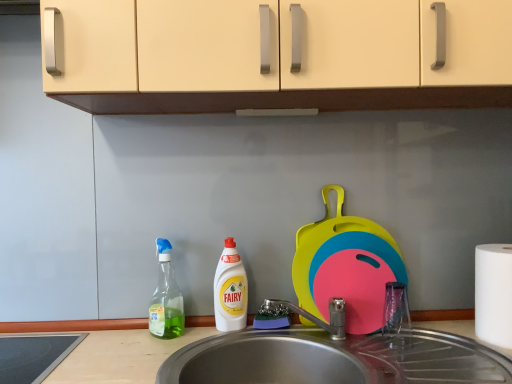
Question: Should I look upward or downward to see transparent plastic spray bottle at left?

Choices:
 (A) down
 (B) up

Answer: (A)

Question: Can you confirm if white plastic bottle at center is bigger than white matte paper towel at right?

Choices:
 (A) yes
 (B) no

Answer: (B)

Question: Can you confirm if white plastic bottle at center is positioned to the left of white matte paper towel at right?

Choices:
 (A) yes
 (B) no

Answer: (A)

Question: Can you confirm if white plastic bottle at center is positioned to the right of white matte paper towel at right?

Choices:
 (A) yes
 (B) no

Answer: (B)

Question: Is white plastic bottle at center further to camera compared to white matte paper towel at right?

Choices:
 (A) no
 (B) yes

Answer: (B)

Question: Is white plastic bottle at center touching white matte paper towel at right?

Choices:
 (A) yes
 (B) no

Answer: (B)

Question: Is white plastic bottle at center taller than white matte paper towel at right?

Choices:
 (A) no
 (B) yes

Answer: (B)

Question: From a real-world perspective, is white matte paper towel at right located beneath white plastic bottle at center?

Choices:
 (A) yes
 (B) no

Answer: (A)

Question: Is white matte paper towel at right facing towards white plastic bottle at center?

Choices:
 (A) no
 (B) yes

Answer: (A)

Question: Does white matte paper towel at right have a larger size compared to white plastic bottle at center?

Choices:
 (A) yes
 (B) no

Answer: (A)

Question: Is white matte paper towel at right smaller than white plastic bottle at center?

Choices:
 (A) no
 (B) yes

Answer: (A)

Question: Is white matte paper towel at right facing away from white plastic bottle at center?

Choices:
 (A) no
 (B) yes

Answer: (A)

Question: Is white matte paper towel at right closer to the viewer compared to white plastic bottle at center?

Choices:
 (A) yes
 (B) no

Answer: (A)

Question: From the image's perspective, is metallic stainless steel sink at lower center under white matte paper towel at right?

Choices:
 (A) yes
 (B) no

Answer: (A)